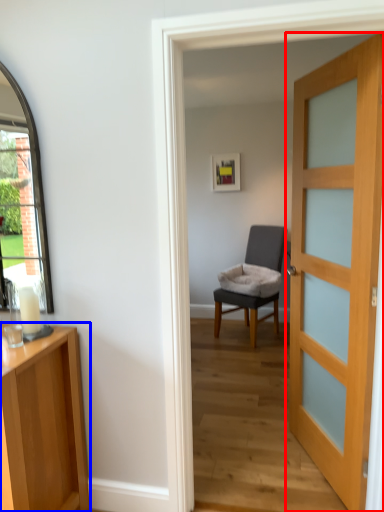
Question: Which point is closer to the camera, door (highlighted by a red box) or cabinetry (highlighted by a blue box)?

Choices:
 (A) door
 (B) cabinetry

Answer: (B)